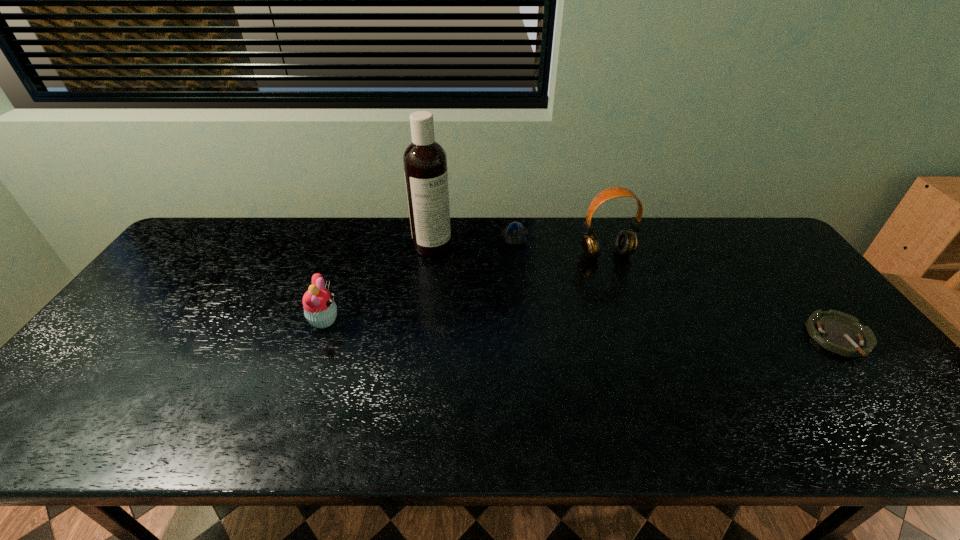
Locate an element on the screen. vacant space located on the label side of the fourth object from right to left is located at coordinates pyautogui.click(x=472, y=270).

Where is `headset situated at the far edge`? The width and height of the screenshot is (960, 540). headset situated at the far edge is located at coordinates (626, 242).

Where is `computer mouse that is at the far edge`? This screenshot has width=960, height=540. computer mouse that is at the far edge is located at coordinates (515, 234).

Locate an element on the screen. The width and height of the screenshot is (960, 540). dishwasher detergent that is at the far edge is located at coordinates (425, 162).

Where is `object positioned at the right edge`? Image resolution: width=960 pixels, height=540 pixels. object positioned at the right edge is located at coordinates click(x=841, y=333).

Find the location of a particular element. This screenshot has height=540, width=960. free space at the far edge of the desktop is located at coordinates (348, 225).

Locate an element on the screen. The width and height of the screenshot is (960, 540). vacant space at the near edge is located at coordinates (512, 399).

This screenshot has height=540, width=960. Identify the location of vacant space at the left edge of the desktop. (151, 295).

Image resolution: width=960 pixels, height=540 pixels. In the image, there is a desktop. Identify the location of vacant space at the right edge. (764, 272).

The height and width of the screenshot is (540, 960). I want to click on free space between the fourth object from left to right and the fourth object from right to left, so click(519, 250).